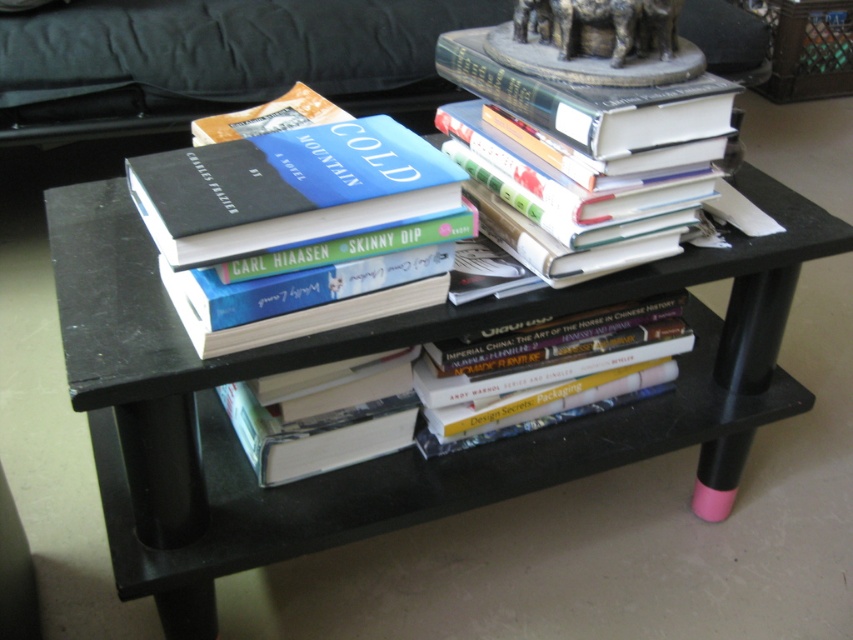
Question: Is matte black book at center to the left of hardcover book at center from the viewer's perspective?

Choices:
 (A) yes
 (B) no

Answer: (A)

Question: Which object is closer to the camera taking this photo?

Choices:
 (A) hardcover books at center
 (B) black matte table at center
 (C) hardcover book at center

Answer: (B)

Question: Is matte black book at center thinner than hardcover books at center?

Choices:
 (A) yes
 (B) no

Answer: (B)

Question: Does matte black book at center come behind hardcover book at center?

Choices:
 (A) no
 (B) yes

Answer: (A)

Question: Which is farther from the hardcover book at center?

Choices:
 (A) hardcover books at center
 (B) black matte table at center

Answer: (A)

Question: Which point appears closest to the camera in this image?

Choices:
 (A) pyautogui.click(x=218, y=189)
 (B) pyautogui.click(x=677, y=413)
 (C) pyautogui.click(x=247, y=451)

Answer: (A)